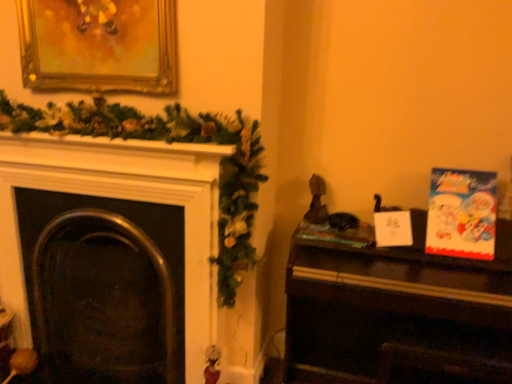
Question: Does wooden piano at right lie in front of gold ornate picture frame at upper left?

Choices:
 (A) yes
 (B) no

Answer: (A)

Question: From a real-world perspective, is wooden piano at right under gold ornate picture frame at upper left?

Choices:
 (A) no
 (B) yes

Answer: (B)

Question: Is wooden piano at right surrounding gold ornate picture frame at upper left?

Choices:
 (A) no
 (B) yes

Answer: (A)

Question: Does wooden piano at right have a larger size compared to gold ornate picture frame at upper left?

Choices:
 (A) no
 (B) yes

Answer: (B)

Question: From the image's perspective, is wooden piano at right below gold ornate picture frame at upper left?

Choices:
 (A) yes
 (B) no

Answer: (A)

Question: Is wooden piano at right aimed at gold ornate picture frame at upper left?

Choices:
 (A) no
 (B) yes

Answer: (A)

Question: Does hardcover book at center-right have a lesser height compared to gold ornate picture frame at upper left?

Choices:
 (A) yes
 (B) no

Answer: (A)

Question: Considering the relative sizes of hardcover book at center-right and gold ornate picture frame at upper left in the image provided, is hardcover book at center-right taller than gold ornate picture frame at upper left?

Choices:
 (A) yes
 (B) no

Answer: (B)

Question: From the image's perspective, is hardcover book at center-right under gold ornate picture frame at upper left?

Choices:
 (A) yes
 (B) no

Answer: (A)

Question: Can you confirm if hardcover book at center-right is bigger than gold ornate picture frame at upper left?

Choices:
 (A) yes
 (B) no

Answer: (B)

Question: Considering the relative positions of hardcover book at center-right and gold ornate picture frame at upper left in the image provided, is hardcover book at center-right behind gold ornate picture frame at upper left?

Choices:
 (A) yes
 (B) no

Answer: (A)

Question: Is hardcover book at center-right smaller than gold ornate picture frame at upper left?

Choices:
 (A) yes
 (B) no

Answer: (A)

Question: Can you confirm if wooden piano at right is wider than metallic dark fireplace at left?

Choices:
 (A) no
 (B) yes

Answer: (B)